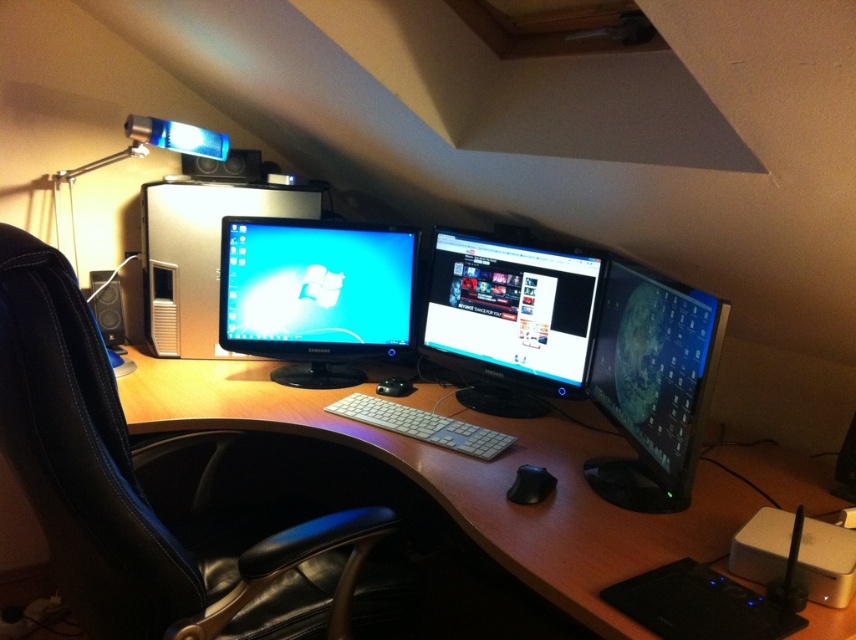
Question: Is black leather swivel chair at left below satin silver monitor at center left?

Choices:
 (A) yes
 (B) no

Answer: (A)

Question: Is the position of satin black monitor at center left more distant than that of black rubber mouse at center?

Choices:
 (A) yes
 (B) no

Answer: (A)

Question: Which point appears closest to the camera in this image?

Choices:
 (A) (241, 381)
 (B) (635, 342)
 (C) (3, 296)
 (D) (544, 490)

Answer: (C)

Question: Is satin black monitor at center left positioned in front of black rubber mouse at center?

Choices:
 (A) yes
 (B) no

Answer: (B)

Question: Which point is closer to the camera?

Choices:
 (A) (294, 328)
 (B) (33, 496)
 (C) (545, 490)
 (D) (164, 320)

Answer: (B)

Question: Which point is farther to the camera?

Choices:
 (A) white plastic keyboard at center
 (B) matte black monitor at right
 (C) satin silver monitor at center left
 (D) black leather swivel chair at left

Answer: (C)